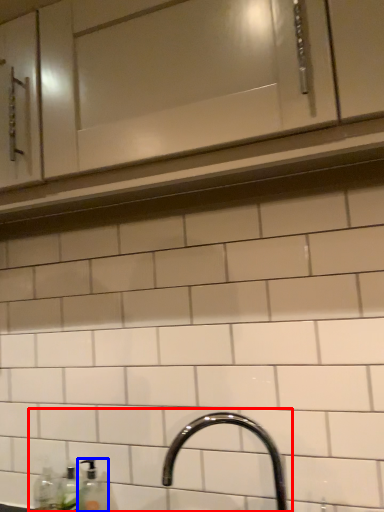
Question: Which object appears closest to the camera in this image, sink (highlighted by a red box) or soap dispenser (highlighted by a blue box)?

Choices:
 (A) sink
 (B) soap dispenser

Answer: (A)